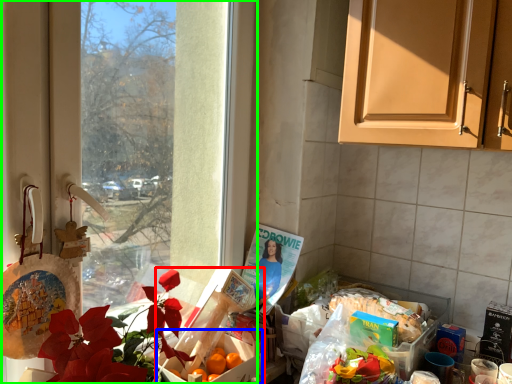
Question: Which is farther away from box (highlighted by a red box)? box (highlighted by a blue box) or window (highlighted by a green box)?

Choices:
 (A) box
 (B) window

Answer: (B)